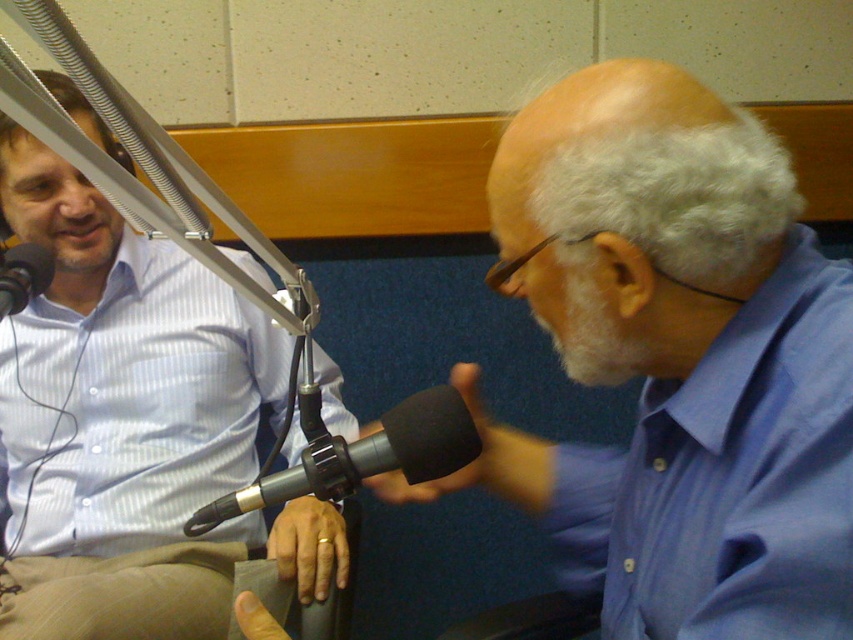
Question: Estimate the real-world distances between objects in this image. Which object is closer to the matte blue shirt at left?

Choices:
 (A) black matte microphone at left
 (B) blue striped shirt at upper right

Answer: (A)

Question: Which object appears closest to the camera in this image?

Choices:
 (A) matte blue shirt at left
 (B) blue striped shirt at upper right
 (C) black matte microphone at center
 (D) black matte microphone at left

Answer: (B)

Question: Can you confirm if blue glossy shirt at right is wider than black matte microphone at left?

Choices:
 (A) yes
 (B) no

Answer: (A)

Question: Among these points, which one is nearest to the camera?

Choices:
 (A) (3, 296)
 (B) (355, 444)
 (C) (793, 352)
 (D) (734, 456)

Answer: (C)

Question: Does blue glossy shirt at right appear on the right side of blue striped shirt at upper right?

Choices:
 (A) no
 (B) yes

Answer: (A)

Question: Is matte blue shirt at left to the left of blue striped shirt at upper right from the viewer's perspective?

Choices:
 (A) yes
 (B) no

Answer: (A)